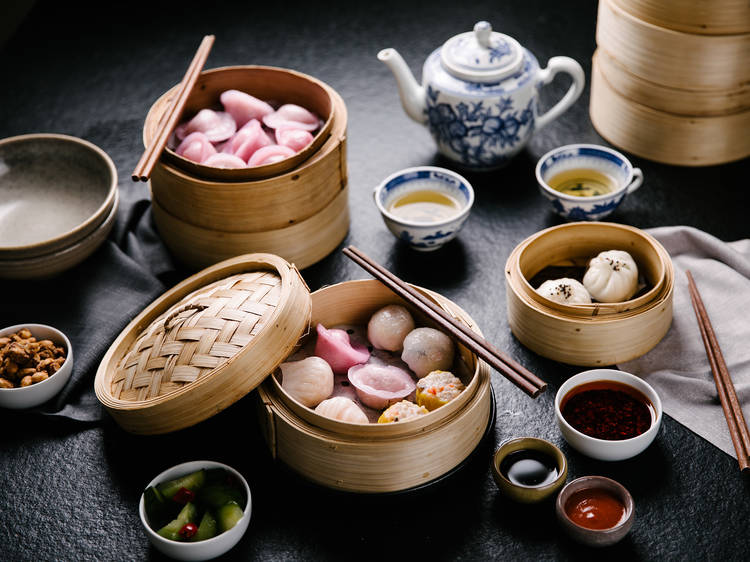
I want to click on chopsticks, so [x=168, y=125], [x=169, y=108], [x=451, y=318], [x=460, y=334], [x=712, y=362], [x=720, y=362].